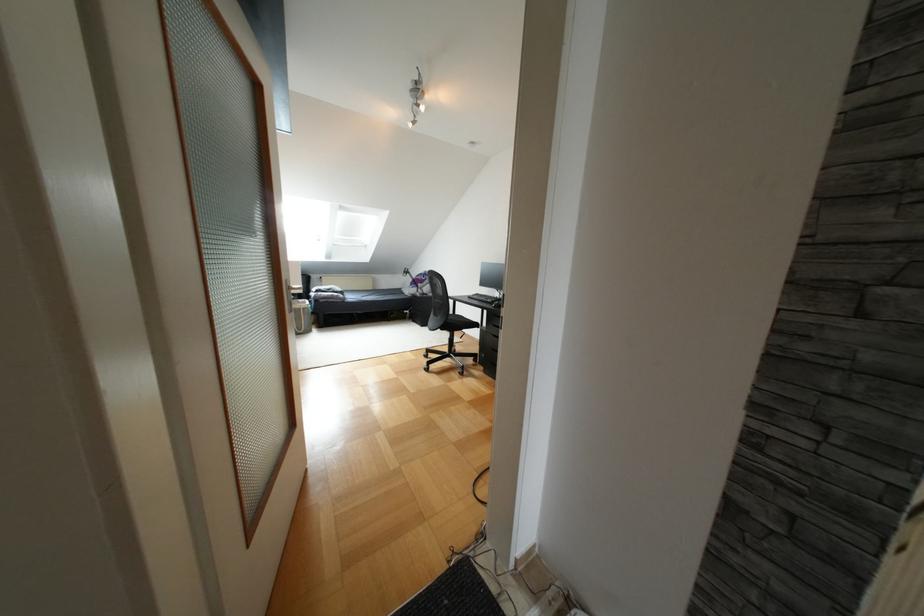
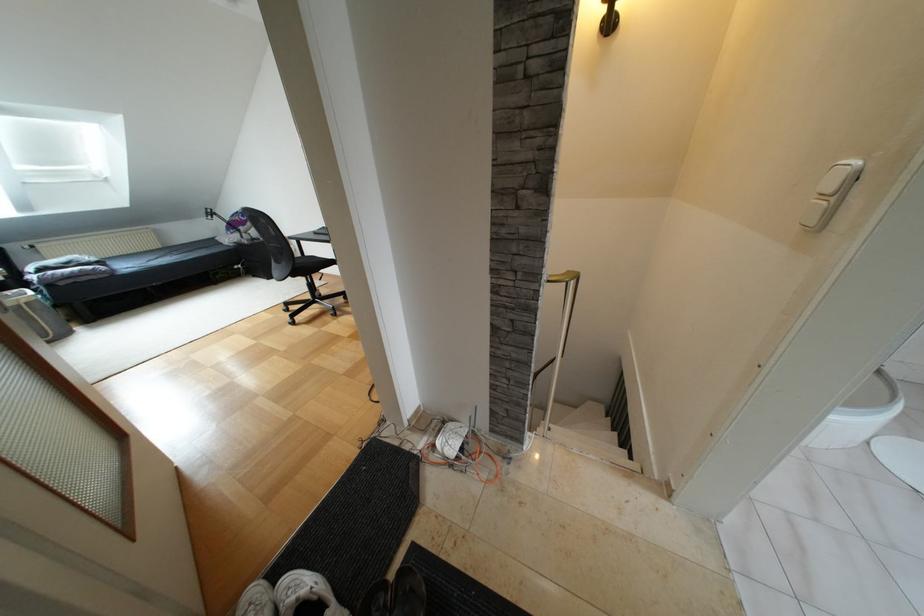
Locate, in the second image, the point that corresponds to the point at 435,278 in the first image.

(258, 217)